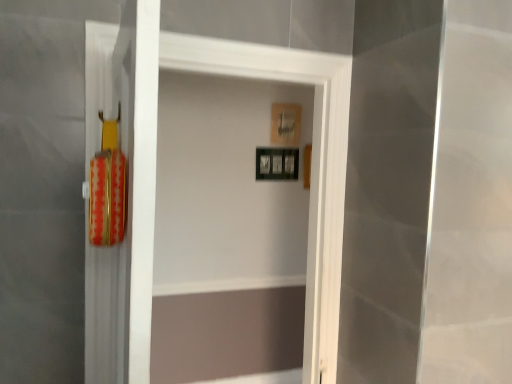
What do you see at coordinates (277, 163) in the screenshot? This screenshot has width=512, height=384. I see `black matte picture frame at center, arranged as the 2th picture frame when viewed from the top` at bounding box center [277, 163].

What is the approximate height of black matte picture frame at center, arranged as the 2th picture frame when viewed from the top?

black matte picture frame at center, arranged as the 2th picture frame when viewed from the top, is 8.64 inches in height.

Measure the distance between black matte picture frame at center, arranged as the 2th picture frame when viewed from the top, and camera.

The distance of black matte picture frame at center, arranged as the 2th picture frame when viewed from the top, from camera is 2.68 meters.

You are a GUI agent. You are given a task and a screenshot of the screen. Output one action in this format:
    pyautogui.click(x=<x>, y=<y>)
    Task: Click on the black matte picture frame at center, which appears as the first picture frame when ordered from the bottom
    This screenshot has height=384, width=512.
    Given the screenshot: What is the action you would take?
    pyautogui.click(x=277, y=163)

I want to click on wooden picture frame at upper center, marked as the first picture frame in a top-to-bottom arrangement, so click(286, 124).

The width and height of the screenshot is (512, 384). What do you see at coordinates (286, 124) in the screenshot?
I see `wooden picture frame at upper center, which appears as the second picture frame when ordered from the bottom` at bounding box center [286, 124].

Find the location of a particular element. This screenshot has height=384, width=512. black matte picture frame at center, arranged as the 2th picture frame when viewed from the top is located at coordinates (277, 163).

Would you say wooden picture frame at upper center, which appears as the second picture frame when ordered from the bottom, is to the left or to the right of black matte picture frame at center, which appears as the first picture frame when ordered from the bottom, in the picture?

In the image, wooden picture frame at upper center, which appears as the second picture frame when ordered from the bottom, appears on the right side of black matte picture frame at center, which appears as the first picture frame when ordered from the bottom.

Which object is closer to the camera, wooden picture frame at upper center, which appears as the second picture frame when ordered from the bottom, or black matte picture frame at center, arranged as the 2th picture frame when viewed from the top?

Positioned in front is black matte picture frame at center, arranged as the 2th picture frame when viewed from the top.

Considering the points (285, 109) and (268, 152), which point is behind, point (285, 109) or point (268, 152)?

Positioned behind is point (285, 109).

From the image's perspective, which one is positioned higher, wooden picture frame at upper center, which appears as the second picture frame when ordered from the bottom, or black matte picture frame at center, which appears as the first picture frame when ordered from the bottom?

wooden picture frame at upper center, which appears as the second picture frame when ordered from the bottom, is shown above in the image.

From a real-world perspective, is wooden picture frame at upper center, which appears as the second picture frame when ordered from the bottom, positioned above or below black matte picture frame at center, which appears as the first picture frame when ordered from the bottom?

wooden picture frame at upper center, which appears as the second picture frame when ordered from the bottom, is above black matte picture frame at center, which appears as the first picture frame when ordered from the bottom.

Which object is wider, wooden picture frame at upper center, marked as the first picture frame in a top-to-bottom arrangement, or black matte picture frame at center, which appears as the first picture frame when ordered from the bottom?

With larger width is black matte picture frame at center, which appears as the first picture frame when ordered from the bottom.

Can you confirm if wooden picture frame at upper center, which appears as the second picture frame when ordered from the bottom, is shorter than black matte picture frame at center, which appears as the first picture frame when ordered from the bottom?

No, wooden picture frame at upper center, which appears as the second picture frame when ordered from the bottom, is not shorter than black matte picture frame at center, which appears as the first picture frame when ordered from the bottom.

Based on the photo, between wooden picture frame at upper center, marked as the first picture frame in a top-to-bottom arrangement, and black matte picture frame at center, arranged as the 2th picture frame when viewed from the top, which one has smaller size?

wooden picture frame at upper center, marked as the first picture frame in a top-to-bottom arrangement, is smaller.

Would you say wooden picture frame at upper center, marked as the first picture frame in a top-to-bottom arrangement, is outside black matte picture frame at center, arranged as the 2th picture frame when viewed from the top?

That's correct, wooden picture frame at upper center, marked as the first picture frame in a top-to-bottom arrangement, is outside of black matte picture frame at center, arranged as the 2th picture frame when viewed from the top.

Is wooden picture frame at upper center, marked as the first picture frame in a top-to-bottom arrangement, not close to black matte picture frame at center, arranged as the 2th picture frame when viewed from the top?

That's not correct — wooden picture frame at upper center, marked as the first picture frame in a top-to-bottom arrangement, is a little close to black matte picture frame at center, arranged as the 2th picture frame when viewed from the top.

Is wooden picture frame at upper center, which appears as the second picture frame when ordered from the bottom, aimed at black matte picture frame at center, which appears as the first picture frame when ordered from the bottom?

No, wooden picture frame at upper center, which appears as the second picture frame when ordered from the bottom, is not oriented towards black matte picture frame at center, which appears as the first picture frame when ordered from the bottom.

Find the location of a particular element. The height and width of the screenshot is (384, 512). picture frame below the wooden picture frame at upper center, which appears as the second picture frame when ordered from the bottom (from a real-world perspective) is located at coordinates (277, 163).

Consider the image. Which is more to the left, black matte picture frame at center, which appears as the first picture frame when ordered from the bottom, or wooden picture frame at upper center, which appears as the second picture frame when ordered from the bottom?

From the viewer's perspective, black matte picture frame at center, which appears as the first picture frame when ordered from the bottom, appears more on the left side.

Between black matte picture frame at center, arranged as the 2th picture frame when viewed from the top, and wooden picture frame at upper center, which appears as the second picture frame when ordered from the bottom, which one is positioned in front?

black matte picture frame at center, arranged as the 2th picture frame when viewed from the top.

Which point is more distant from viewer, (291, 166) or (297, 107)?

Point (291, 166)

From the image's perspective, relative to wooden picture frame at upper center, marked as the first picture frame in a top-to-bottom arrangement, is black matte picture frame at center, which appears as the first picture frame when ordered from the bottom, above or below?

black matte picture frame at center, which appears as the first picture frame when ordered from the bottom, is situated lower than wooden picture frame at upper center, marked as the first picture frame in a top-to-bottom arrangement, in the image.

In the scene shown: From a real-world perspective, is black matte picture frame at center, arranged as the 2th picture frame when viewed from the top, over wooden picture frame at upper center, which appears as the second picture frame when ordered from the bottom?

No, from a real-world perspective, black matte picture frame at center, arranged as the 2th picture frame when viewed from the top, is not on top of wooden picture frame at upper center, which appears as the second picture frame when ordered from the bottom.

Does black matte picture frame at center, arranged as the 2th picture frame when viewed from the top, have a lesser width compared to wooden picture frame at upper center, marked as the first picture frame in a top-to-bottom arrangement?

No.

Which of these two, black matte picture frame at center, which appears as the first picture frame when ordered from the bottom, or wooden picture frame at upper center, which appears as the second picture frame when ordered from the bottom, stands shorter?

black matte picture frame at center, which appears as the first picture frame when ordered from the bottom, is shorter.

Looking at the image, does black matte picture frame at center, arranged as the 2th picture frame when viewed from the top, seem bigger or smaller compared to wooden picture frame at upper center, which appears as the second picture frame when ordered from the bottom?

Considering their sizes, black matte picture frame at center, arranged as the 2th picture frame when viewed from the top, takes up more space than wooden picture frame at upper center, which appears as the second picture frame when ordered from the bottom.

Would you say wooden picture frame at upper center, marked as the first picture frame in a top-to-bottom arrangement, is part of black matte picture frame at center, arranged as the 2th picture frame when viewed from the top,'s contents?

Actually, wooden picture frame at upper center, marked as the first picture frame in a top-to-bottom arrangement, is outside black matte picture frame at center, arranged as the 2th picture frame when viewed from the top.

Are black matte picture frame at center, arranged as the 2th picture frame when viewed from the top, and wooden picture frame at upper center, marked as the first picture frame in a top-to-bottom arrangement, located far from each other?

They are positioned close to each other.

Is black matte picture frame at center, which appears as the first picture frame when ordered from the bottom, looking in the opposite direction of wooden picture frame at upper center, marked as the first picture frame in a top-to-bottom arrangement?

That's not correct — black matte picture frame at center, which appears as the first picture frame when ordered from the bottom, is not looking away from wooden picture frame at upper center, marked as the first picture frame in a top-to-bottom arrangement.

Image resolution: width=512 pixels, height=384 pixels. In order to click on picture frame behind the black matte picture frame at center, which appears as the first picture frame when ordered from the bottom in this screenshot , I will do `click(286, 124)`.

Image resolution: width=512 pixels, height=384 pixels. Identify the location of picture frame located above the black matte picture frame at center, arranged as the 2th picture frame when viewed from the top (from the image's perspective). (286, 124).

I want to click on picture frame that appears behind the black matte picture frame at center, which appears as the first picture frame when ordered from the bottom, so click(x=286, y=124).